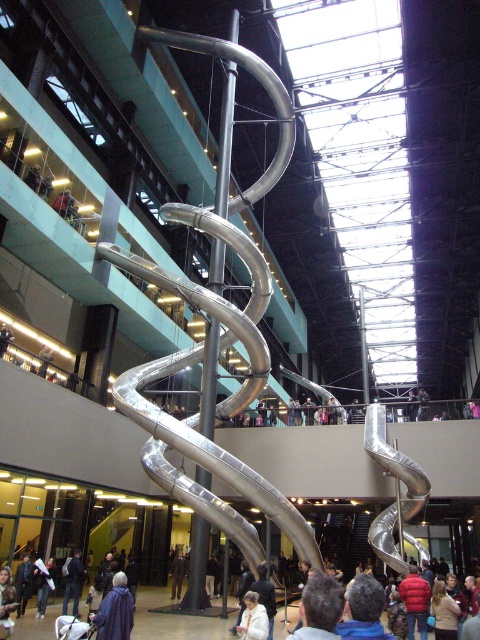
You are standing in the indoor space and see the purple fabric coat at lower center and the dark blue jacket at lower left. Which one is positioned more to the right side of the scene?

The purple fabric coat at lower center is positioned more to the right side of the scene compared to the dark blue jacket at lower left.